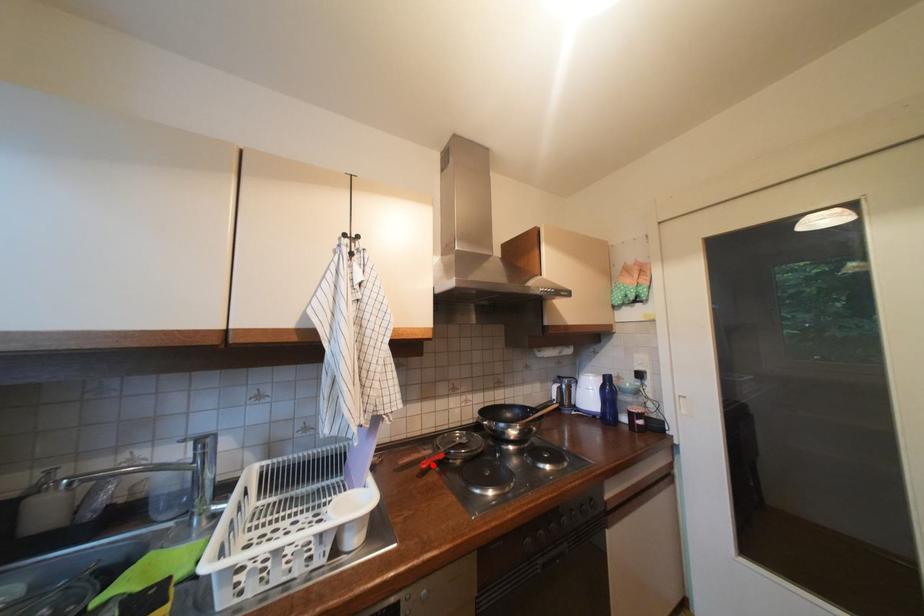
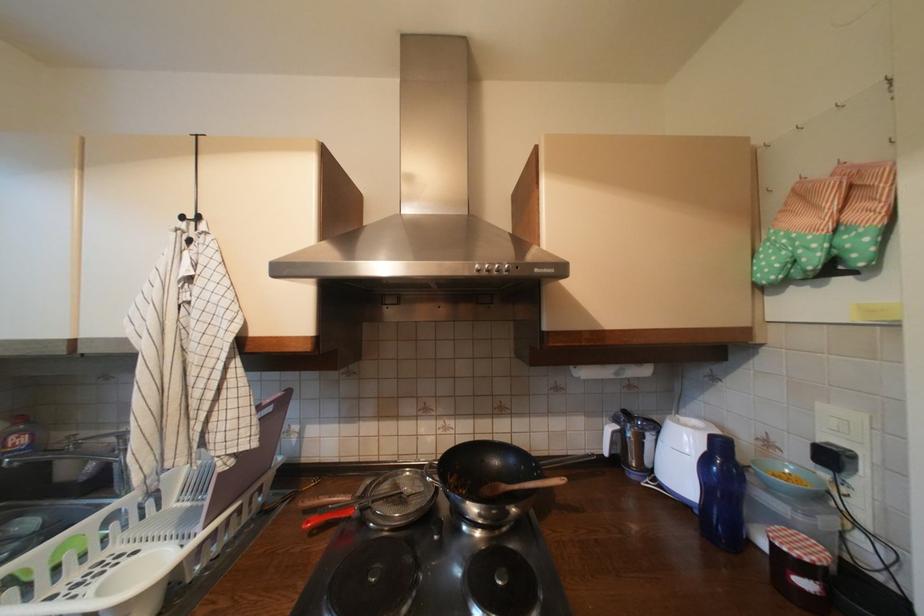
Question: I am providing you with two images of the same scene from different viewpoints. A red point is marked on the first image. Can you still see the location of the red point in image 2?

Choices:
 (A) Yes
 (B) No

Answer: (A)